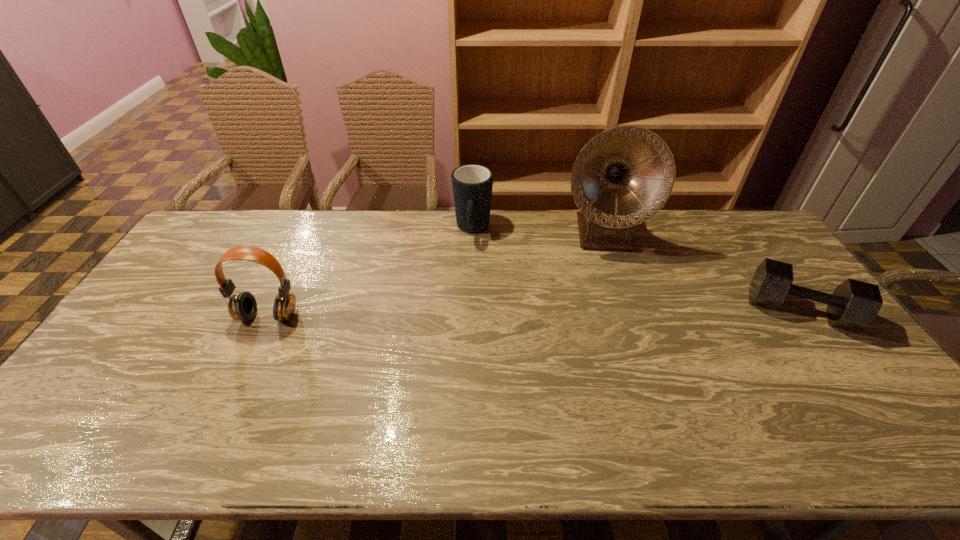
The image size is (960, 540). Find the location of `vacant space at the far right corner`. vacant space at the far right corner is located at coordinates (714, 222).

The width and height of the screenshot is (960, 540). What are the coordinates of `free space between the second object from right to left and the leftmost object` in the screenshot? It's located at (435, 275).

Where is `free space between the shortest object and the second object from right to left`? free space between the shortest object and the second object from right to left is located at coordinates (701, 272).

Where is `free point between the leftmost object and the second object from right to left`? Image resolution: width=960 pixels, height=540 pixels. free point between the leftmost object and the second object from right to left is located at coordinates (435, 275).

Locate an element on the screen. This screenshot has width=960, height=540. vacant point located between the second object from right to left and the second object from left to right is located at coordinates (537, 232).

Where is `vacant space that is in between the second object from right to left and the leftmost object`? The width and height of the screenshot is (960, 540). vacant space that is in between the second object from right to left and the leftmost object is located at coordinates (435, 275).

Find the location of `free space that is in between the rightmost object and the mug`. free space that is in between the rightmost object and the mug is located at coordinates (636, 270).

Locate an element on the screen. The width and height of the screenshot is (960, 540). free spot between the tallest object and the rightmost object is located at coordinates (701, 272).

Locate an element on the screen. empty space between the tallest object and the headset is located at coordinates (435, 275).

Image resolution: width=960 pixels, height=540 pixels. Identify the location of vacant space that's between the dumbbell and the phonograph record. (701, 272).